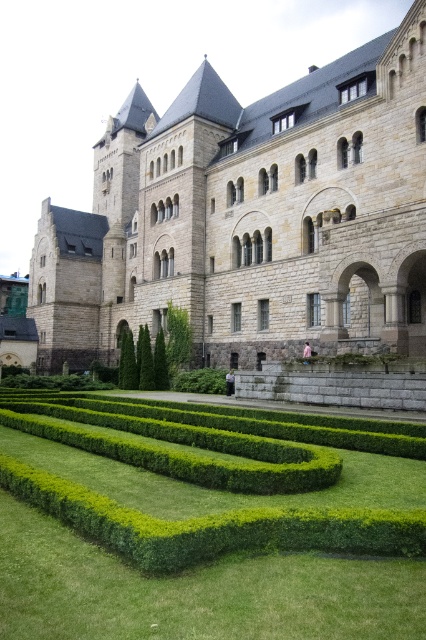
Describe the element at coordinates (209, 554) in the screenshot. I see `green hedge at center` at that location.

Is green hedge at center to the right of green leafy bush at lower center from the viewer's perspective?

Yes, green hedge at center is to the right of green leafy bush at lower center.

Find the location of a particular element. The image size is (426, 640). green hedge at center is located at coordinates (209, 554).

You are a GUI agent. You are given a task and a screenshot of the screen. Output one action in this format:
    pyautogui.click(x=<x>, y=<y>)
    Task: Click on the green hedge at center
    The image size is (426, 640).
    Given the screenshot: What is the action you would take?
    pyautogui.click(x=209, y=554)

Does gray stone castle at center appear under green hedge at center?

Incorrect, gray stone castle at center is not positioned below green hedge at center.

Looking at this image, who is taller, gray stone castle at center or green hedge at center?

gray stone castle at center

Measure the distance between gray stone castle at center and camera.

gray stone castle at center is 50.77 meters away from camera.

Find the location of a particular element. This screenshot has height=640, width=426. gray stone castle at center is located at coordinates (250, 216).

Is point (83, 228) behind point (181, 358)?

Yes, it is.

Is gray stone castle at center positioned before green leafy bush at lower center?

Yes, it is in front of green leafy bush at lower center.

Does point (385, 300) lie behind point (172, 356)?

That is False.

In order to click on gray stone castle at center in this screenshot , I will do `click(250, 216)`.